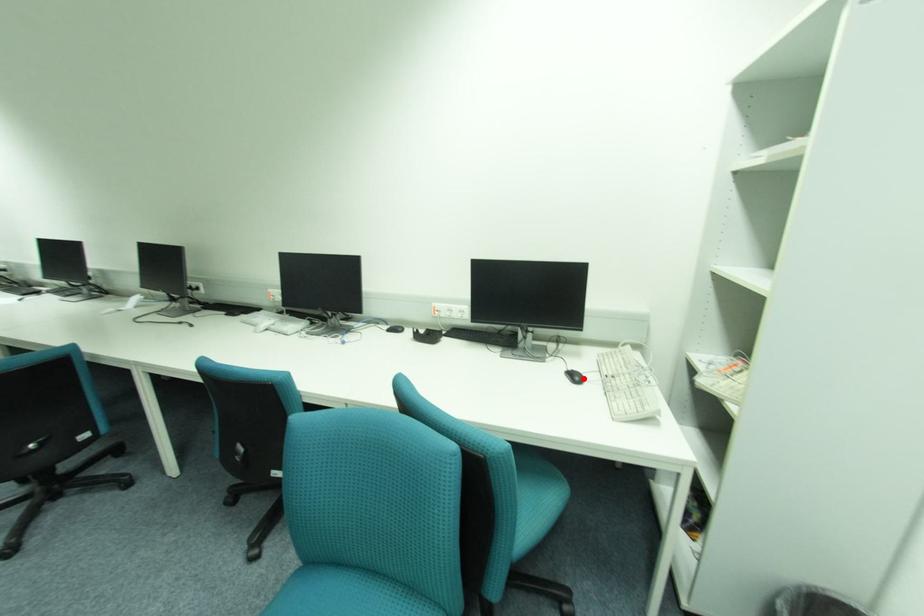
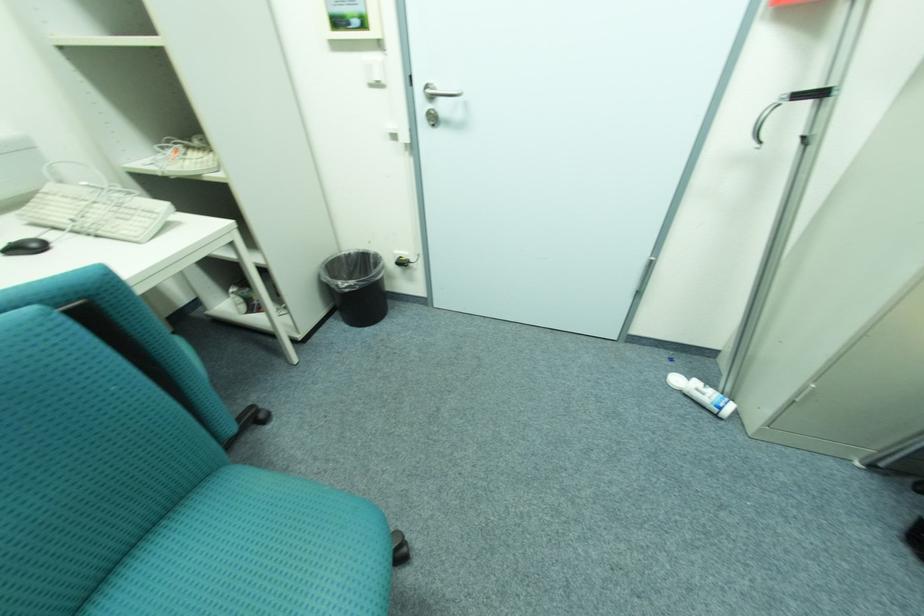
In the second image, find the point that corresponds to the highlighted location in the first image.

(43, 246)